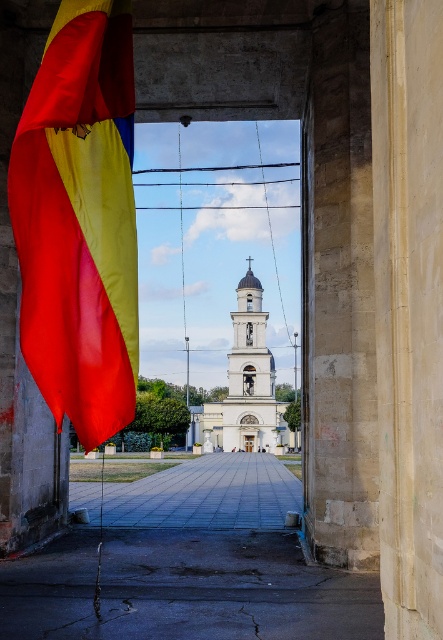
You are standing in a courtyard and want to get a clear view of the white stone church at center. The matte fabric flag at left is blocking your view. How can you adjust your position to see the church without the flag obstructing it?

Move to the right side of the matte fabric flag at left so that the flag no longer blocks your line of sight to the white stone church at center.

You are an architect designing a new path that must pass between the matte fabric flag at left and the white stone church at center. Given their sizes, which object will require more consideration in terms of spacing to ensure adequate clearance?

The white stone church at center requires more consideration for spacing since it is larger than the matte fabric flag at left, necessitating a wider path for proper clearance.